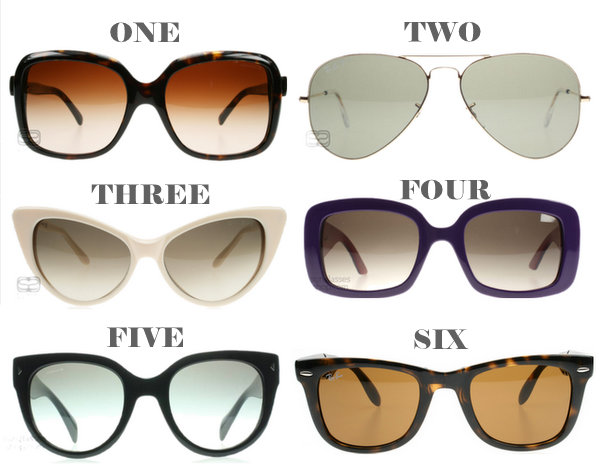
Where is `dark brown frames`? This screenshot has height=468, width=600. dark brown frames is located at coordinates (424, 385).